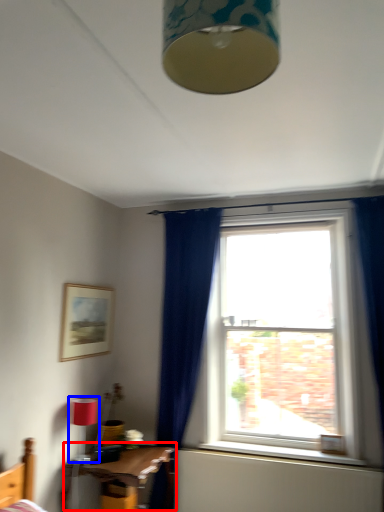
Question: Which object is further to the camera taking this photo, table (highlighted by a red box) or light fixture (highlighted by a blue box)?

Choices:
 (A) table
 (B) light fixture

Answer: (B)